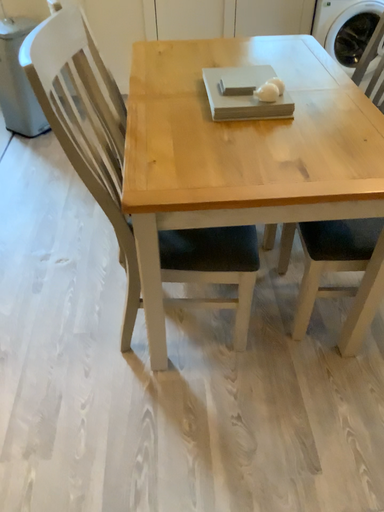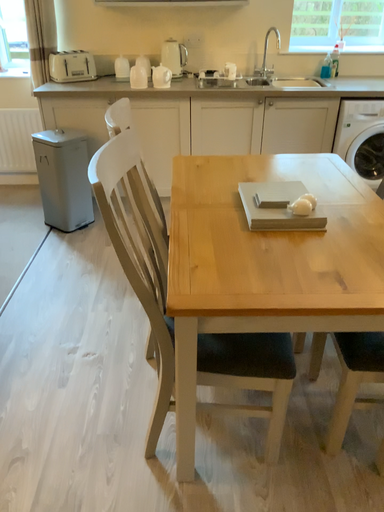
Question: How did the camera likely rotate when shooting the video?

Choices:
 (A) rotated downward
 (B) rotated upward

Answer: (B)